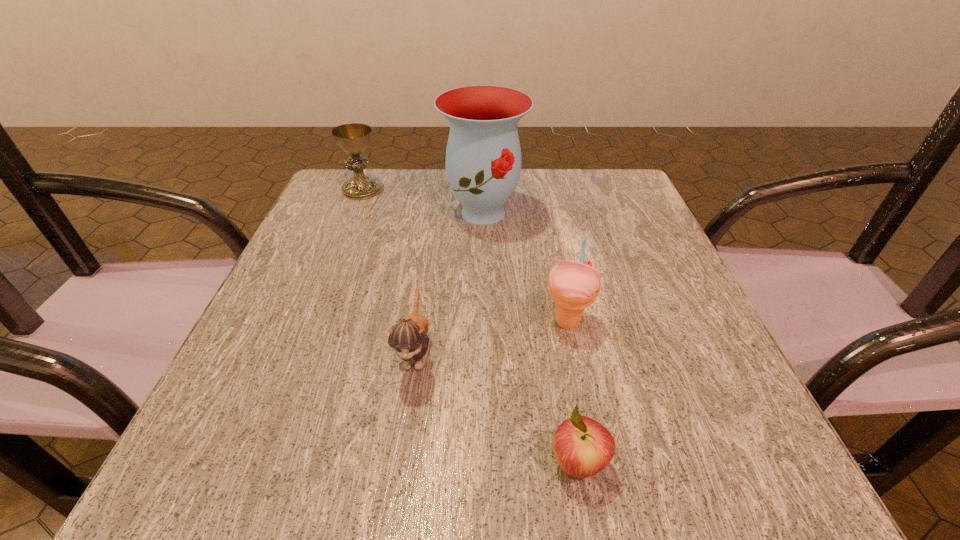
Image resolution: width=960 pixels, height=540 pixels. I want to click on vase at the far edge, so click(483, 156).

Where is `chalice that is at the far edge`? chalice that is at the far edge is located at coordinates pos(353,138).

Locate an element on the screen. This screenshot has width=960, height=540. object at the near edge is located at coordinates (582, 446).

At what (x,y) coordinates should I click in order to perform the action: click on object positioned at the left edge. Please return your answer as a coordinate pair (x, y). Looking at the image, I should click on click(353, 138).

This screenshot has width=960, height=540. I want to click on object located in the far left corner section of the desktop, so click(353, 138).

This screenshot has width=960, height=540. What are the coordinates of `vacant region at the far edge` in the screenshot? It's located at (525, 215).

This screenshot has height=540, width=960. Identify the location of vacant space at the near edge of the desktop. (449, 486).

The image size is (960, 540). Identify the location of free spot at the left edge of the desktop. [309, 254].

Locate an element on the screen. Image resolution: width=960 pixels, height=540 pixels. vacant region at the right edge of the desktop is located at coordinates (666, 279).

The width and height of the screenshot is (960, 540). In the image, there is a desktop. In order to click on vacant area at the far left corner in this screenshot , I will do `click(369, 213)`.